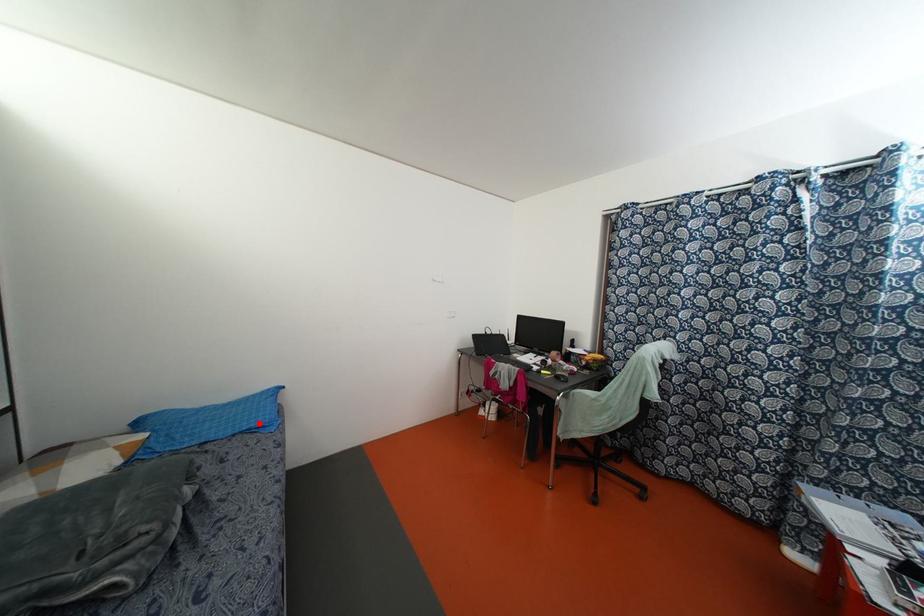
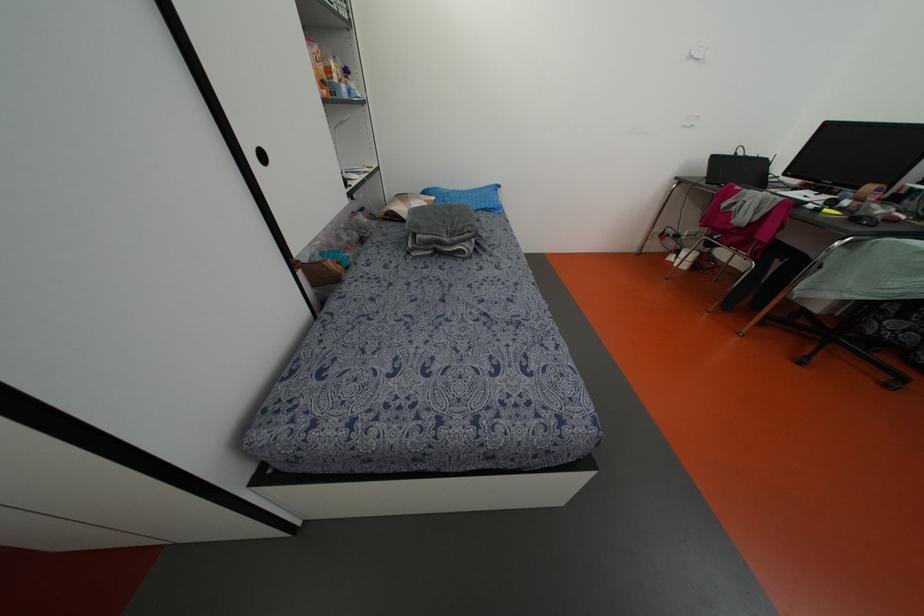
Question: I am providing you with two images of the same scene from different viewpoints. Given a red point in image1, look at the same physical point in image2. Is it:

Choices:
 (A) Closer to the viewpoint
 (B) Farther from the viewpoint

Answer: (B)